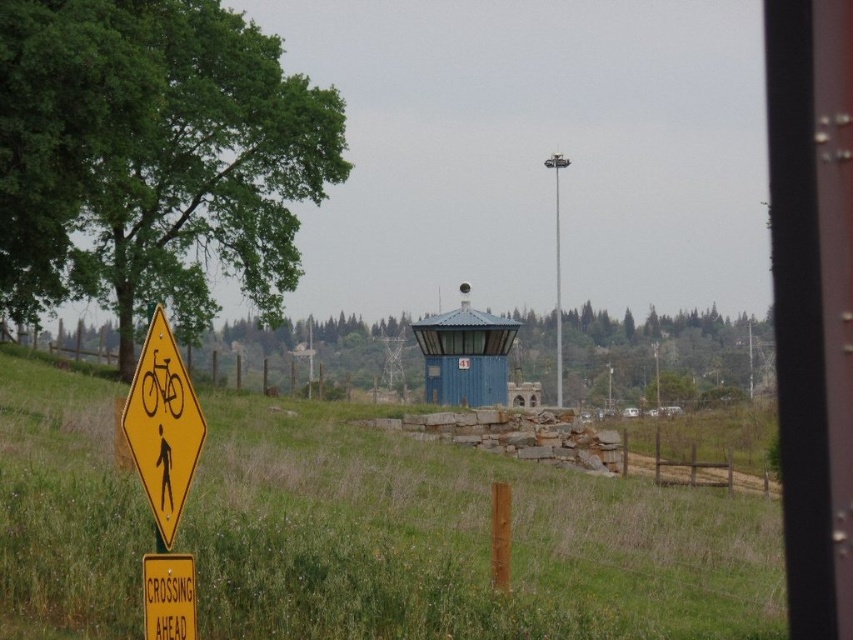
Question: Which of the following is the closest to the observer?

Choices:
 (A) blue matte hut at center
 (B) yellow plastic diamond at left
 (C) brushed metal pole at upper center

Answer: (B)

Question: Which object appears farthest from the camera in this image?

Choices:
 (A) yellow plastic diamond at left
 (B) yellow plastic sign at lower left
 (C) green grassy at lower left

Answer: (C)

Question: Does blue matte hut at center appear on the right side of brushed metal pole at upper center?

Choices:
 (A) no
 (B) yes

Answer: (A)

Question: Is yellow plastic diamond at left to the left of blue matte hut at center from the viewer's perspective?

Choices:
 (A) yes
 (B) no

Answer: (A)

Question: Can you confirm if green grassy at lower left is positioned to the left of yellow plastic sign at lower left?

Choices:
 (A) yes
 (B) no

Answer: (B)

Question: Which point is closer to the camera?

Choices:
 (A) (440, 324)
 (B) (131, 588)
 (C) (555, 355)

Answer: (B)